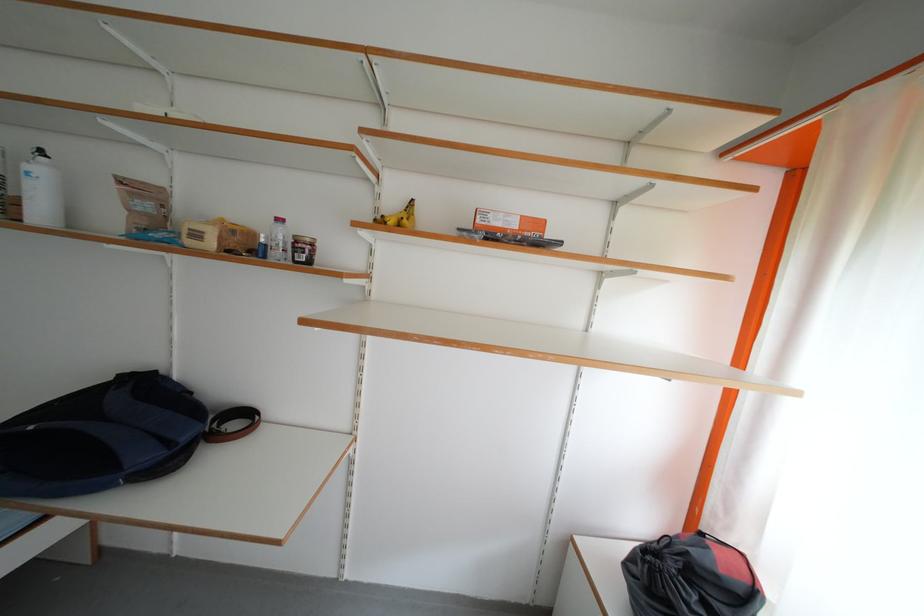
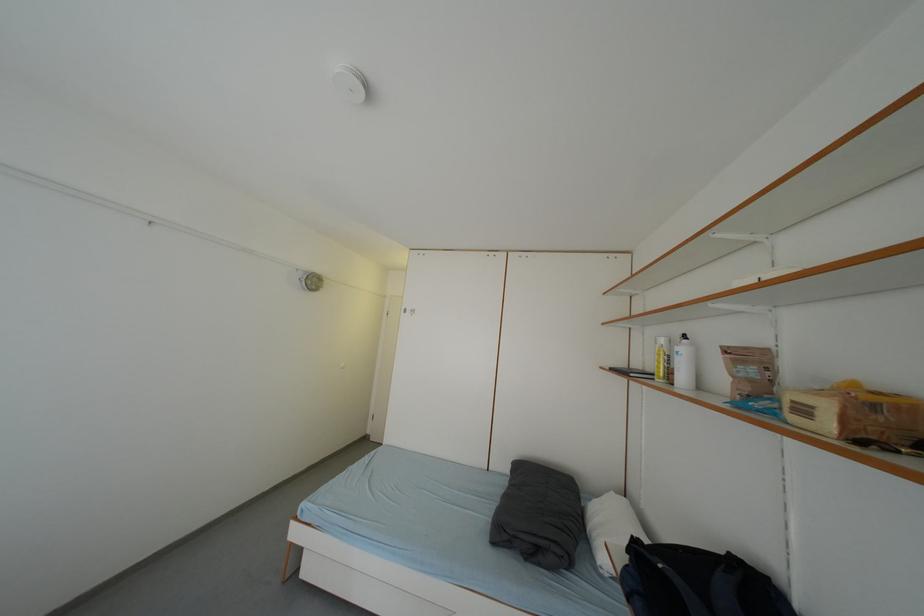
Question: The camera is either moving clockwise (left) or counter-clockwise (right) around the object. The first image is from the beginning of the video and the second image is from the end. Is the camera moving left or right when shooting the video?

Choices:
 (A) Left
 (B) Right

Answer: (B)